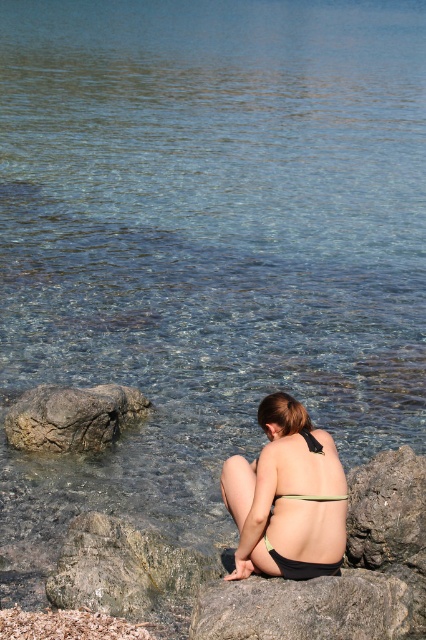
You are a photographer trying to capture the black matte bikini top at center without the green mossy rock at lower left blocking it. What should you do?

Move the camera position backward to ensure the green mossy rock at lower left is no longer in front of the black matte bikini top at center.

You are standing at the point with coordinates point [310,436] and want to walk towards the point with coordinates point [55,397]. Which direction should you face to move towards it?

You should face towards the direction of point [55,397] because it is behind point [310,436].

You are a photographer trying to capture the black matte bikini top at center and the gray rough rock at lower left in the same frame. Which object would you need to focus on first if you want to ensure both are in sharp focus?

The gray rough rock at lower left is larger in size than the black matte bikini top at center, so you should focus on the gray rough rock at lower left first to ensure both are in sharp focus since it requires a wider depth of field.